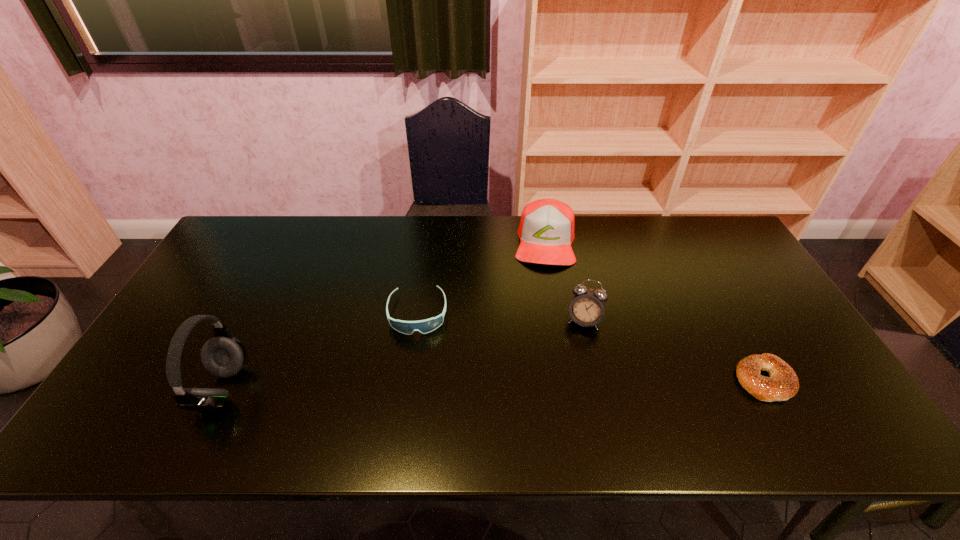
This screenshot has width=960, height=540. Find the location of `vacant space located on the front-facing side of the goggles`. vacant space located on the front-facing side of the goggles is located at coordinates (416, 382).

Where is `vacant space located 0.060m on the front-facing side of the goggles`? The height and width of the screenshot is (540, 960). vacant space located 0.060m on the front-facing side of the goggles is located at coordinates (417, 355).

Where is `free space located 0.110m on the front-facing side of the goggles`? Image resolution: width=960 pixels, height=540 pixels. free space located 0.110m on the front-facing side of the goggles is located at coordinates (416, 372).

Image resolution: width=960 pixels, height=540 pixels. Find the location of `blank area located on the front-facing side of the baseball cap`. blank area located on the front-facing side of the baseball cap is located at coordinates (545, 362).

Locate an element on the screen. This screenshot has height=540, width=960. vacant region located 0.180m on the front-facing side of the baseball cap is located at coordinates (545, 311).

Identify the location of vacant space situated on the front-facing side of the baseball cap. point(545,314).

Find the location of `free point located on the face of the alarm clock`. free point located on the face of the alarm clock is located at coordinates (572, 372).

Locate an element on the screen. The height and width of the screenshot is (540, 960). vacant area situated on the face of the alarm clock is located at coordinates (576, 351).

Locate an element on the screen. The height and width of the screenshot is (540, 960). free region located on the face of the alarm clock is located at coordinates (569, 382).

This screenshot has height=540, width=960. Find the location of `object located in the far edge section of the desktop`. object located in the far edge section of the desktop is located at coordinates (546, 230).